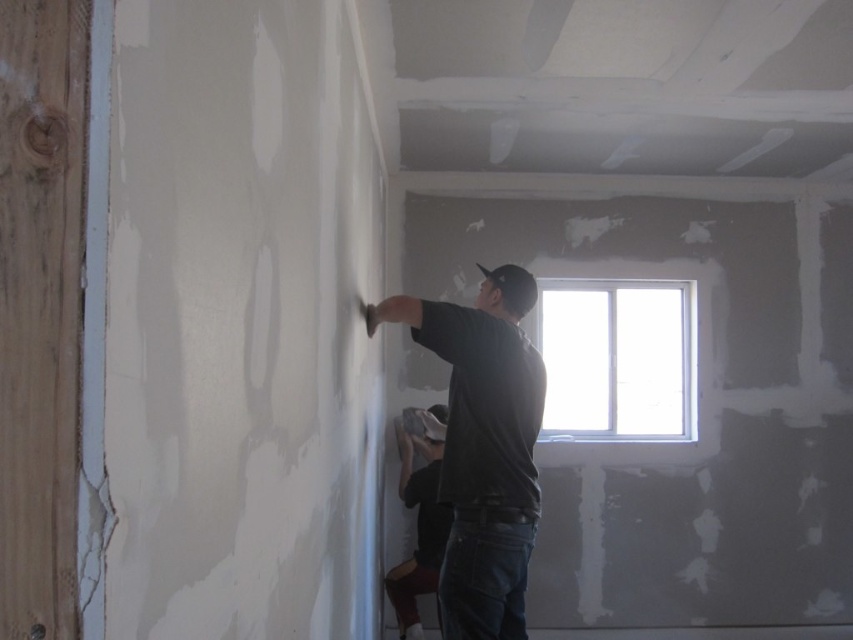
You are a contractor measuring the space between the dark gray matte shirt at center and the clear glass window at upper center. Which object has a smaller width?

The dark gray matte shirt at center has a smaller width than the clear glass window at upper center.

You are an observer in the room and see the dark gray matte shirt at center and the dark gray shirt at center. Which one is taller?

The dark gray matte shirt at center is much taller as dark gray shirt at center.

You are a contractor assessing the renovation progress. You notice the dark gray matte shirt at center and the clear glass window at upper center. Which object is positioned higher in the image?

The dark gray matte shirt at center is much taller than the clear glass window at upper center, so the dark gray matte shirt at center is positioned higher in the image.